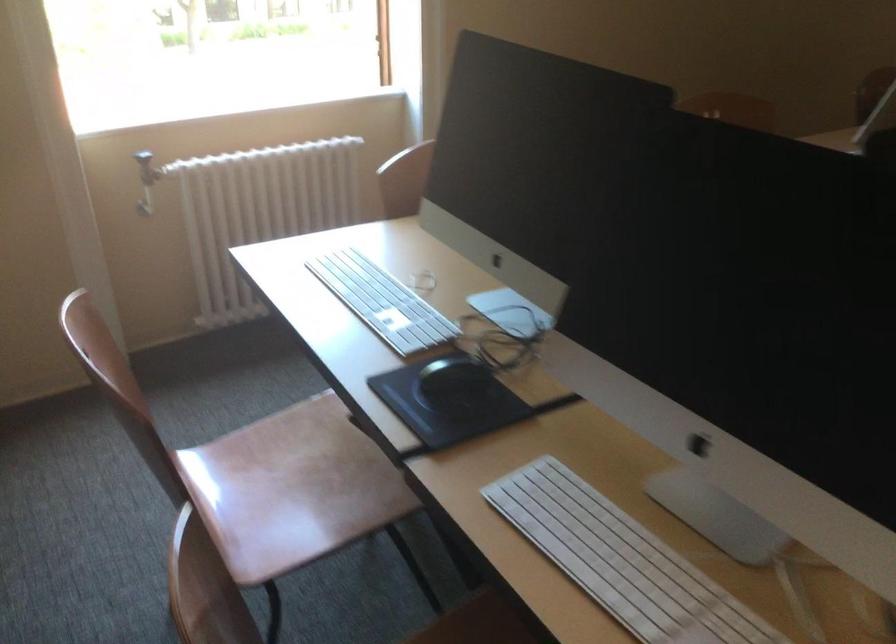
This screenshot has height=644, width=896. I want to click on chair sitting surface, so click(x=291, y=488).